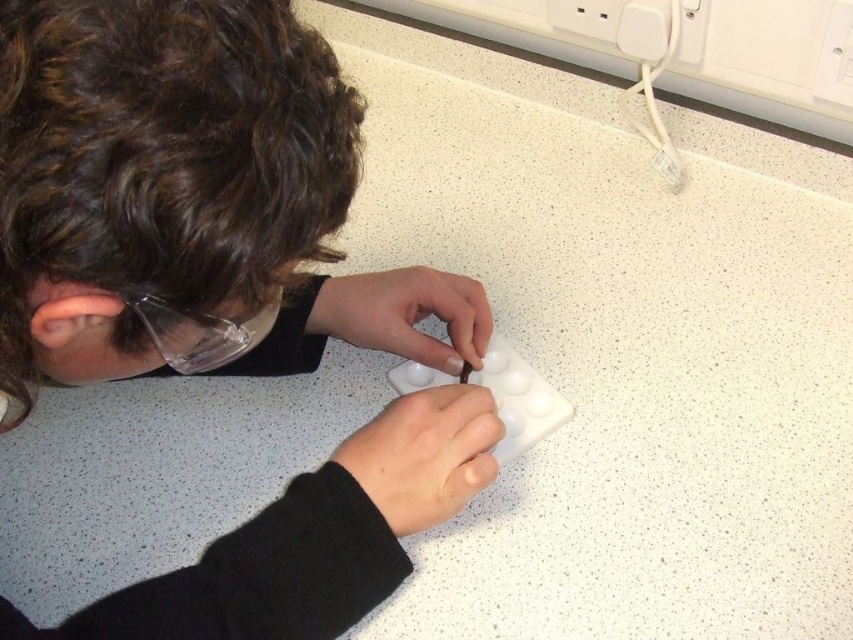
Is white matte pill container at lower center taller than white matte pill box at center?

Indeed, white matte pill container at lower center has a greater height compared to white matte pill box at center.

Does white matte pill container at lower center lie in front of white matte pill box at center?

Yes, it is.

Is point (380, 509) closer to camera compared to point (345, 321)?

Yes, it is.

The height and width of the screenshot is (640, 853). Identify the location of white matte pill container at lower center. (424, 454).